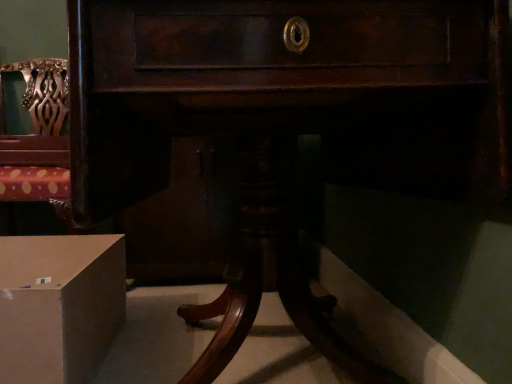
This screenshot has height=384, width=512. What do you see at coordinates (59, 305) in the screenshot?
I see `matte cardboard box at lower left` at bounding box center [59, 305].

Locate an element on the screen. The image size is (512, 384). matte cardboard box at lower left is located at coordinates (59, 305).

The width and height of the screenshot is (512, 384). Find the location of `matte cardboard box at lower left`. matte cardboard box at lower left is located at coordinates (59, 305).